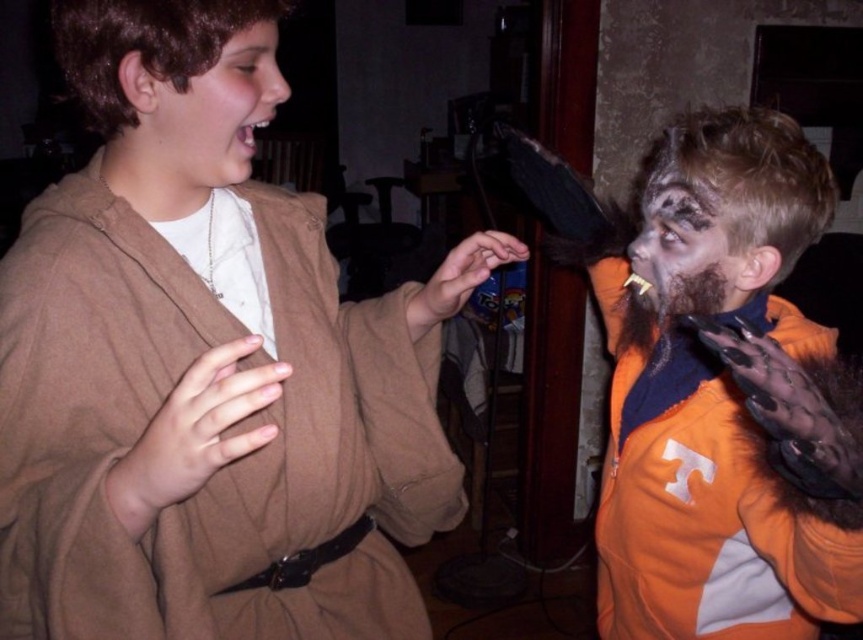
Question: Which object is the closest to the brown matte hair at upper left?

Choices:
 (A) gray matte face at right
 (B) brown fuzzy beard at right

Answer: (A)

Question: Which point is farther from the camera taking this photo?

Choices:
 (A) (791, 390)
 (B) (746, 275)
 (C) (252, 138)

Answer: (C)

Question: Is gray matte face at right to the right of brown fuzzy beard at right from the viewer's perspective?

Choices:
 (A) yes
 (B) no

Answer: (A)

Question: Is brown matte hair at upper left wider than brown fuzzy beard at right?

Choices:
 (A) no
 (B) yes

Answer: (B)

Question: Does brown matte hair at upper left appear under brown fuzzy beard at right?

Choices:
 (A) no
 (B) yes

Answer: (A)

Question: Which point is closer to the camera?

Choices:
 (A) (266, 90)
 (B) (635, 323)
 (C) (436, 508)

Answer: (A)